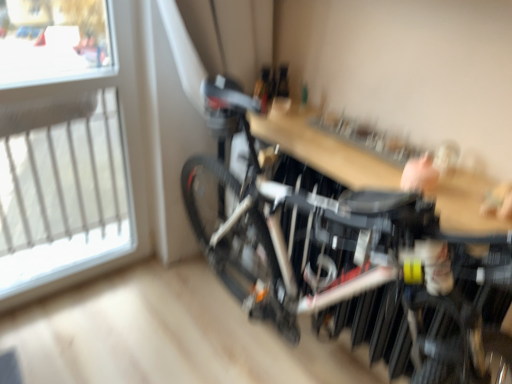
Measure the distance between point (367, 147) and camera.

They are 4.30 feet apart.

The image size is (512, 384). What do you see at coordinates (70, 163) in the screenshot?
I see `transparent glass window at upper left` at bounding box center [70, 163].

You are a GUI agent. You are given a task and a screenshot of the screen. Output one action in this format:
    pyautogui.click(x=<x>, y=<y>)
    Task: Click on the black matte bicycle at center
    The height and width of the screenshot is (384, 512).
    Given the screenshot: What is the action you would take?
    pyautogui.click(x=349, y=244)

Considering the sizes of transparent glass window at upper left and black matte bicycle at center in the image, is transparent glass window at upper left wider or thinner than black matte bicycle at center?

Considering their sizes, transparent glass window at upper left looks slimmer than black matte bicycle at center.

Is transparent glass window at upper left beside black matte bicycle at center?

No, transparent glass window at upper left is not in contact with black matte bicycle at center.

Between transparent glass window at upper left and black matte bicycle at center, which one has more height?

Standing taller between the two is transparent glass window at upper left.

Which point is more distant from viewer, (51,162) or (214,214)?

The point (51,162) is farther.

Does wooden table at center touch transparent glass window at upper left?

They are not placed beside each other.

Is wooden table at center oriented towards transparent glass window at upper left?

No, wooden table at center does not turn towards transparent glass window at upper left.

Can you confirm if wooden table at center is wider than transparent glass window at upper left?

Indeed, wooden table at center has a greater width compared to transparent glass window at upper left.

Is wooden table at center in front of transparent glass window at upper left?

Yes, it is.

Which is more to the left, wooden table at center or black matte bicycle at center?

Positioned to the left is black matte bicycle at center.

How distant is wooden table at center from black matte bicycle at center?

wooden table at center and black matte bicycle at center are 8.56 inches apart from each other.

Between wooden table at center and black matte bicycle at center, which one is positioned in front?

Positioned in front is black matte bicycle at center.

Between wooden table at center and black matte bicycle at center, which one has more height?

black matte bicycle at center.

At what (x,y) coordinates should I click in order to perform the action: click on table above the transparent glass window at upper left (from the image's perspective). Please return your answer as a coordinate pair (x, y). Looking at the image, I should click on (325, 147).

Is transparent glass window at upper left smaller than wooden table at center?

Incorrect, transparent glass window at upper left is not smaller in size than wooden table at center.

From the image's perspective, which one is positioned lower, transparent glass window at upper left or wooden table at center?

transparent glass window at upper left.

Is black matte bicycle at center oriented towards wooden table at center?

Yes, black matte bicycle at center faces towards wooden table at center.

From the image's perspective, which one is positioned higher, black matte bicycle at center or wooden table at center?

wooden table at center appears higher in the image.

How many degrees apart are the facing directions of black matte bicycle at center and wooden table at center?

They differ by 0.00225 degrees in their facing directions.

Choose the correct answer: Is black matte bicycle at center inside wooden table at center or outside it?

black matte bicycle at center is spatially situated outside wooden table at center.

From a real-world perspective, is black matte bicycle at center on transparent glass window at upper left?

Incorrect, from a real-world perspective, black matte bicycle at center is lower than transparent glass window at upper left.

Which is less distant, (238, 132) or (25, 109)?

Point (238, 132).

The width and height of the screenshot is (512, 384). What are the coordinates of `window that appears on the left of black matte bicycle at center` in the screenshot? It's located at (70, 163).

Is the surface of black matte bicycle at center in direct contact with transparent glass window at upper left?

No, black matte bicycle at center is not making contact with transparent glass window at upper left.

Locate an element on the screen. The image size is (512, 384). bicycle in front of the transparent glass window at upper left is located at coordinates (349, 244).

The image size is (512, 384). I want to click on window that appears below the wooden table at center (from the image's perspective), so click(70, 163).

Based on their spatial positions, is black matte bicycle at center or transparent glass window at upper left closer to wooden table at center?

black matte bicycle at center is closer to wooden table at center.

Based on their spatial positions, is wooden table at center or transparent glass window at upper left closer to black matte bicycle at center?

Among the two, wooden table at center is located nearer to black matte bicycle at center.

Looking at the image, which one is located closer to wooden table at center, transparent glass window at upper left or black matte bicycle at center?

black matte bicycle at center lies closer to wooden table at center than the other object.

Based on their spatial positions, is black matte bicycle at center or wooden table at center closer to transparent glass window at upper left?

black matte bicycle at center is closer to transparent glass window at upper left.

In the scene shown: Based on their spatial positions, is wooden table at center or black matte bicycle at center closer to transparent glass window at upper left?

Among the two, black matte bicycle at center is located nearer to transparent glass window at upper left.

When comparing their distances from black matte bicycle at center, does transparent glass window at upper left or wooden table at center seem closer?

wooden table at center lies closer to black matte bicycle at center than the other object.

Locate an element on the screen. This screenshot has height=384, width=512. bicycle between transparent glass window at upper left and wooden table at center from left to right is located at coordinates (349, 244).